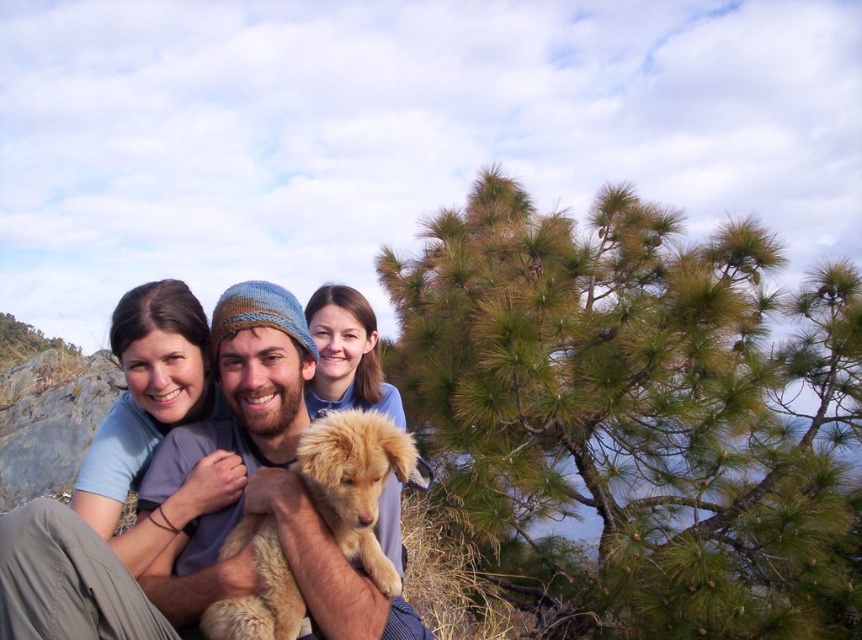
Can you confirm if light brown fur dog at center is taller than golden fur puppy at center?

Yes, light brown fur dog at center is taller than golden fur puppy at center.

Identify the location of light brown fur dog at center. (202, 502).

Who is higher up, green needle-like at upper right or golden fur puppy at center?

green needle-like at upper right is above.

Is green needle-like at upper right to the left of golden fur puppy at center from the viewer's perspective?

In fact, green needle-like at upper right is to the right of golden fur puppy at center.

At what (x,y) coordinates should I click in order to perform the action: click on green needle-like at upper right. Please return your answer as a coordinate pair (x, y). The image size is (862, 640). Looking at the image, I should click on (636, 417).

Can you confirm if green needle-like at upper right is smaller than light brown fur dog at center?

Incorrect, green needle-like at upper right is not smaller in size than light brown fur dog at center.

Who is shorter, green needle-like at upper right or light brown fur dog at center?

light brown fur dog at center is shorter.

Locate an element on the screen. The height and width of the screenshot is (640, 862). green needle-like at upper right is located at coordinates (636, 417).

Locate an element on the screen. The height and width of the screenshot is (640, 862). green needle-like at upper right is located at coordinates (636, 417).